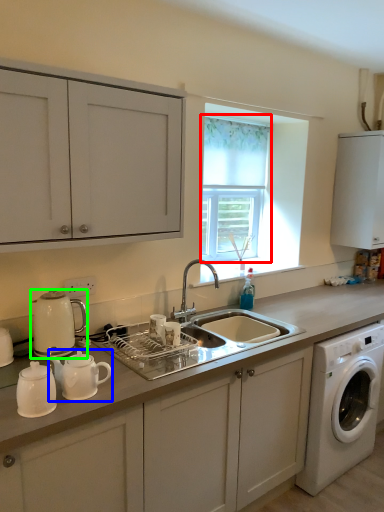
Question: Which object is the closest to the window screen (highlighted by a red box)? Choose among these: tea pot (highlighted by a blue box) or coffeepot (highlighted by a green box).

Choices:
 (A) tea pot
 (B) coffeepot

Answer: (B)